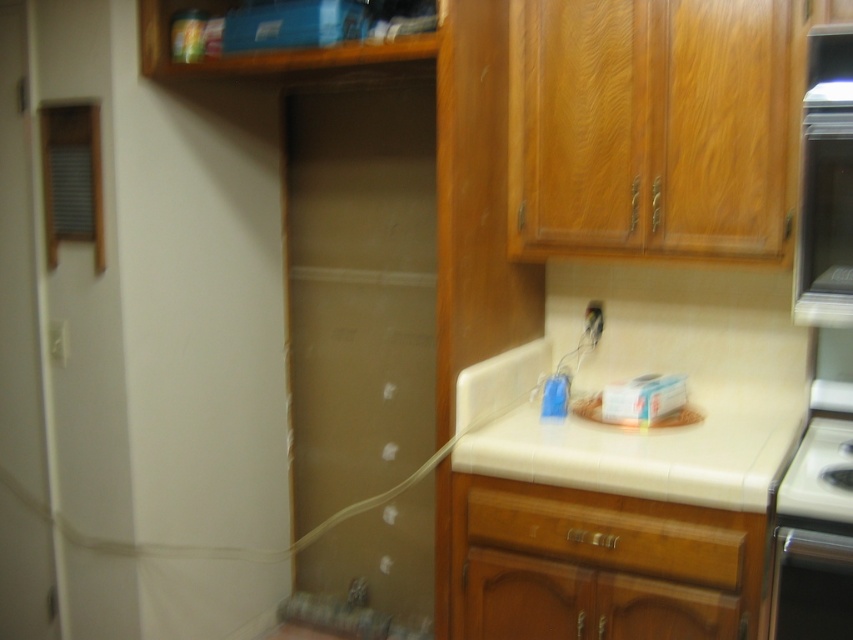
Can you confirm if beige tile countertop at center is positioned below black glossy stove at lower right?

No.

Between point (726, 451) and point (805, 508), which one is positioned behind?

Point (726, 451)

Does point (556, 470) lie behind point (851, 508)?

Yes, point (556, 470) is behind point (851, 508).

Where is `beige tile countertop at center`? beige tile countertop at center is located at coordinates (653, 448).

This screenshot has height=640, width=853. Find the location of `beige tile countertop at center`. beige tile countertop at center is located at coordinates (653, 448).

Which is in front, point (589, 486) or point (685, 531)?

Point (685, 531) is more forward.

Image resolution: width=853 pixels, height=640 pixels. In order to click on beige tile countertop at center in this screenshot , I will do `click(653, 448)`.

At what (x,y) coordinates should I click in order to perform the action: click on beige tile countertop at center. Please return your answer as a coordinate pair (x, y). Looking at the image, I should click on (653, 448).

Does satin black oven at lower right appear over black glossy stove at lower right?

Actually, satin black oven at lower right is below black glossy stove at lower right.

Measure the distance between satin black oven at lower right and black glossy stove at lower right.

satin black oven at lower right and black glossy stove at lower right are 7.32 inches apart.

Locate an element on the screen. The image size is (853, 640). satin black oven at lower right is located at coordinates (810, 584).

Locate an element on the screen. The image size is (853, 640). satin black oven at lower right is located at coordinates (810, 584).